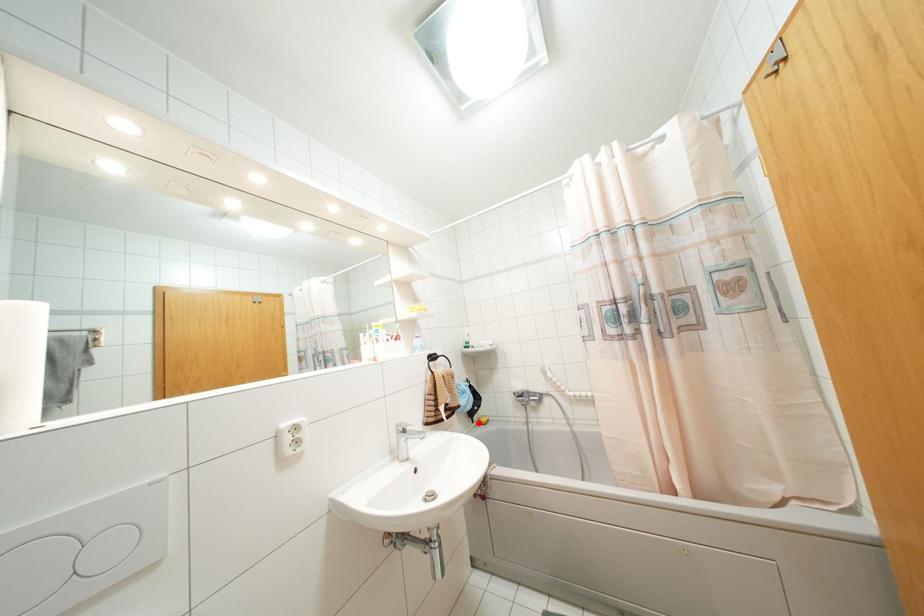
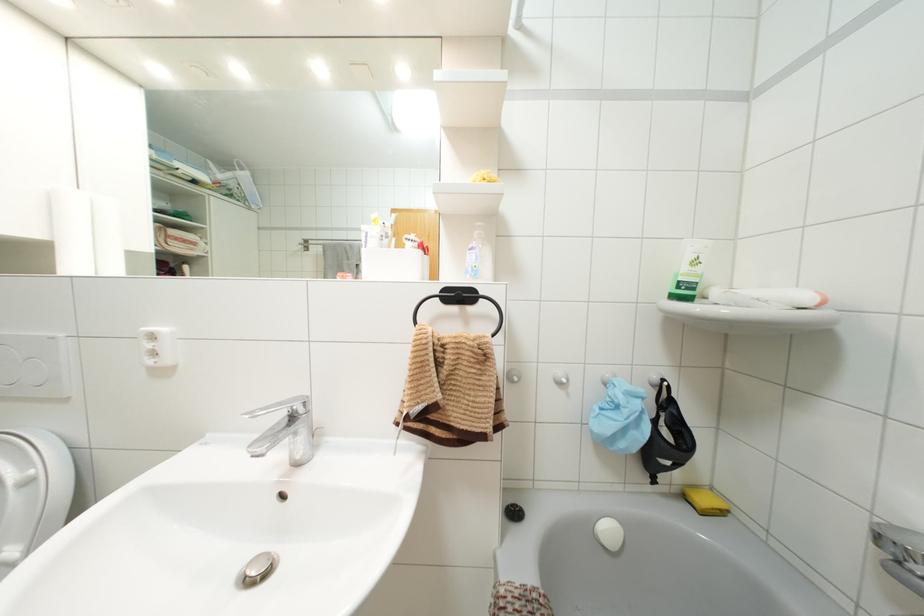
Question: A red point is marked in image1. In image2, is the corresponding 3D point closer to the camera or farther? Reply with the corresponding letter.

Choices:
 (A) The corresponding 3D point is closer.
 (B) The corresponding 3D point is farther.

Answer: (A)